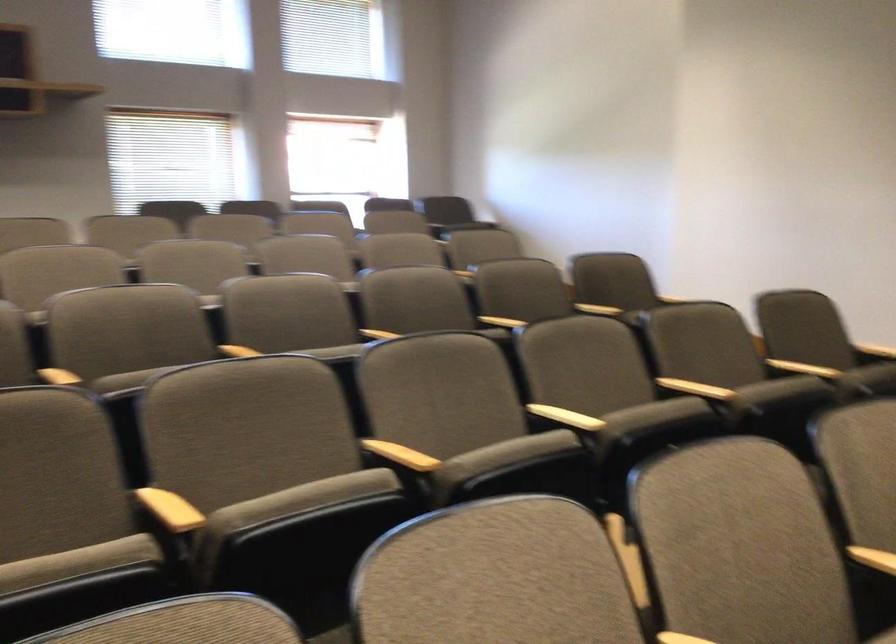
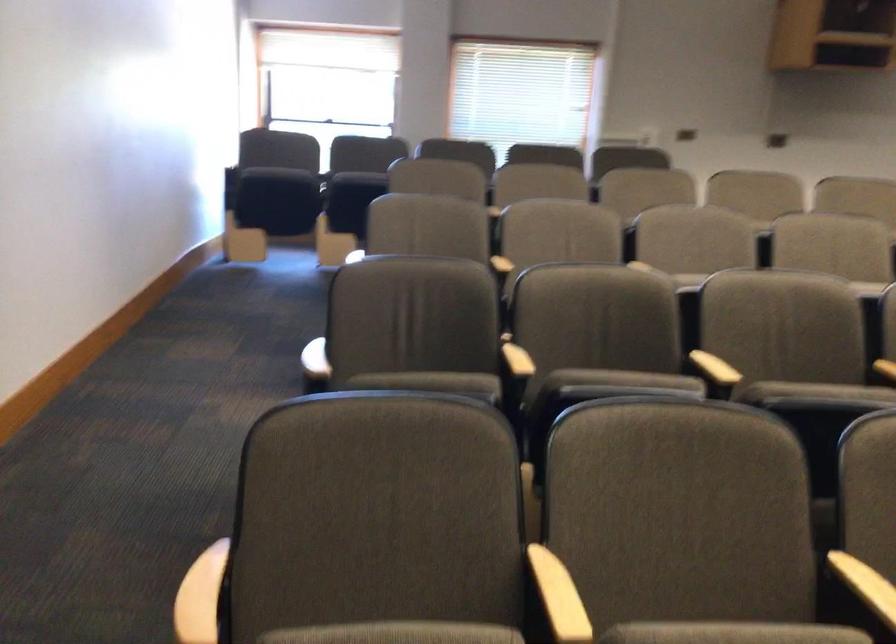
Question: In a continuous first-person perspective shot, in which direction is the camera moving?

Choices:
 (A) Left
 (B) Right
 (C) Forward
 (D) Backward

Answer: (D)